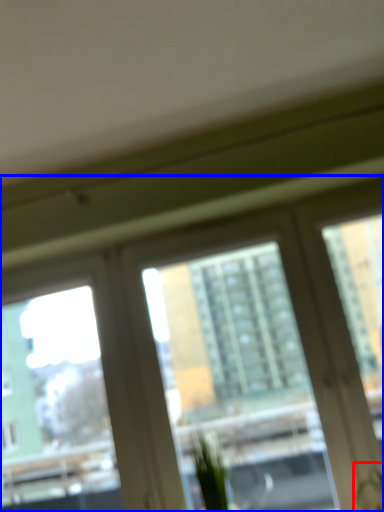
Question: Which object appears closest to the camera in this image, plant (highlighted by a red box) or window (highlighted by a blue box)?

Choices:
 (A) plant
 (B) window

Answer: (A)